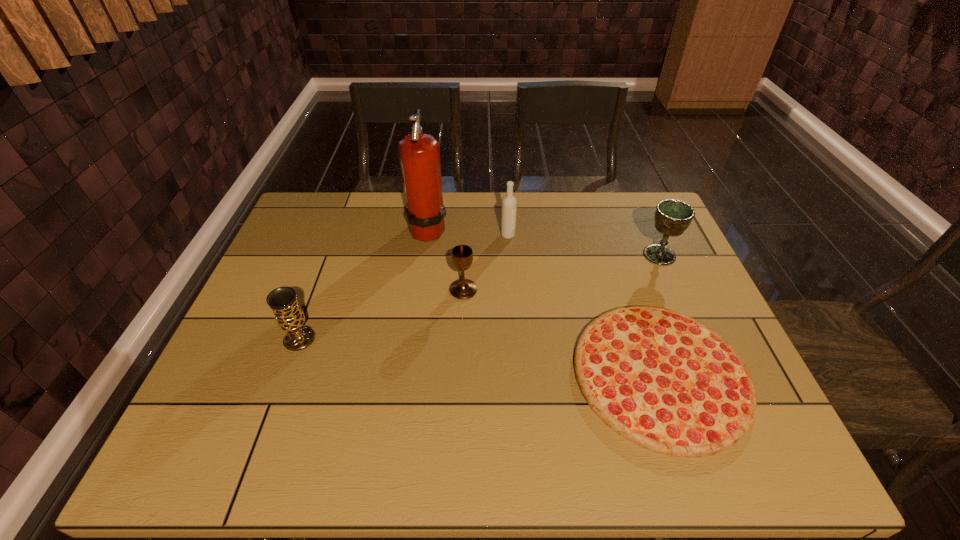
Locate an element on the screen. Image resolution: width=960 pixels, height=540 pixels. the tallest object is located at coordinates (419, 153).

Where is `fire extinguisher`? Image resolution: width=960 pixels, height=540 pixels. fire extinguisher is located at coordinates (419, 153).

The height and width of the screenshot is (540, 960). I want to click on the third object from right to left, so click(x=509, y=203).

This screenshot has width=960, height=540. I want to click on the farthest chalice, so click(672, 217).

Locate an element on the screen. This screenshot has width=960, height=540. the leftmost object is located at coordinates (289, 316).

Locate an element on the screen. Image resolution: width=960 pixels, height=540 pixels. the nearest chalice is located at coordinates (289, 316).

You are a GUI agent. You are given a task and a screenshot of the screen. Output one action in this format:
    pyautogui.click(x=<x>, y=<y>)
    Task: Click on the second farthest chalice
    This screenshot has width=960, height=540.
    Given the screenshot: What is the action you would take?
    pyautogui.click(x=461, y=255)

Image resolution: width=960 pixels, height=540 pixels. In order to click on the second chalice from right to left in this screenshot , I will do `click(461, 255)`.

Locate an element on the screen. This screenshot has width=960, height=540. the shortest object is located at coordinates (663, 380).

Image resolution: width=960 pixels, height=540 pixels. I want to click on vacant space situated at the nozzle of the tallest object, so click(x=498, y=228).